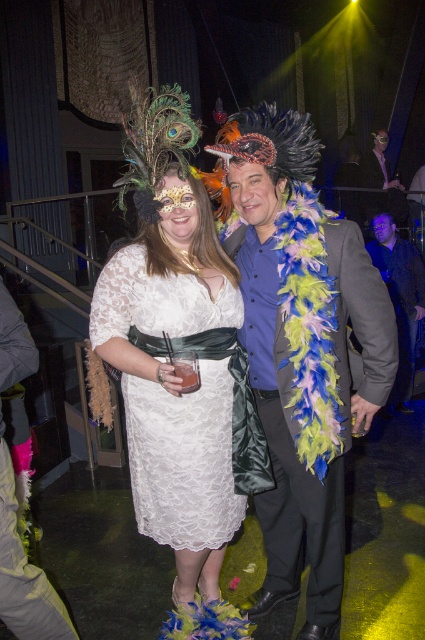
Does shiny blue feather boa at center have a lesser width compared to white lace dress at center?

In fact, shiny blue feather boa at center might be wider than white lace dress at center.

Does shiny blue feather boa at center have a larger size compared to white lace dress at center?

Yes, shiny blue feather boa at center is bigger than white lace dress at center.

Is point (345, 273) positioned after point (95, 298)?

No, (345, 273) is in front of (95, 298).

This screenshot has width=425, height=640. Find the location of `shiny blue feather boa at center`. shiny blue feather boa at center is located at coordinates (300, 348).

Is white lace dress at center thinner than shiny black jacket at upper right?

No, white lace dress at center is not thinner than shiny black jacket at upper right.

Identify the location of white lace dress at center. (183, 403).

Is point (244, 480) behind point (360, 177)?

No.

You are a GUI agent. You are given a task and a screenshot of the screen. Output one action in this format:
    pyautogui.click(x=<x>, y=<y>)
    Task: Click on the white lace dress at center
    The width and height of the screenshot is (425, 640).
    Given the screenshot: What is the action you would take?
    pyautogui.click(x=183, y=403)

Is point (325, 464) positioned after point (404, 339)?

No.

You are a GUI agent. You are given a task and a screenshot of the screen. Output one action in this format:
    pyautogui.click(x=<x>, y=<y>)
    Task: Click on the shiny blue feather boa at center
    This screenshot has width=425, height=640.
    Given the screenshot: What is the action you would take?
    pyautogui.click(x=300, y=348)

Describe the element at coordinates (300, 348) in the screenshot. I see `shiny blue feather boa at center` at that location.

This screenshot has height=640, width=425. I want to click on shiny blue feather boa at center, so click(x=300, y=348).